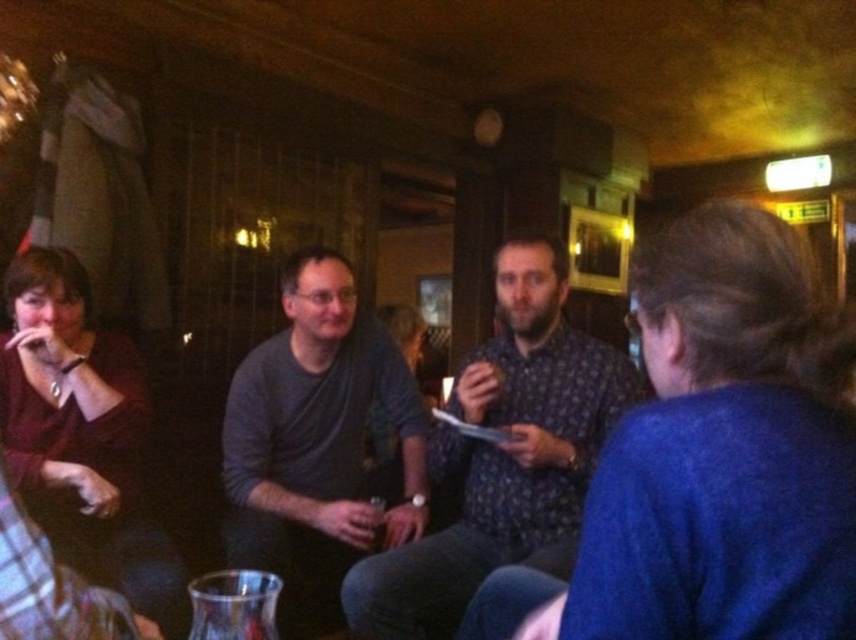
Question: Which point is farther to the camera?

Choices:
 (A) (64, 522)
 (B) (468, 358)
 (C) (407, 481)

Answer: (C)

Question: Which is nearer to the dark gray sweater at center?

Choices:
 (A) matte burgundy sweater at left
 (B) floral-patterned shirt at center

Answer: (B)

Question: Considering the relative positions of blue sweater at right and dark gray sweater at center in the image provided, where is blue sweater at right located with respect to dark gray sweater at center?

Choices:
 (A) right
 (B) left

Answer: (A)

Question: Does matte burgundy sweater at left appear over clear glass at center?

Choices:
 (A) no
 (B) yes

Answer: (B)

Question: Which object is closer to the camera taking this photo?

Choices:
 (A) clear glass at center
 (B) floral-patterned shirt at center
 (C) dark gray sweater at center
 (D) blue sweater at right

Answer: (D)

Question: Is blue sweater at right thinner than matte burgundy sweater at left?

Choices:
 (A) yes
 (B) no

Answer: (A)